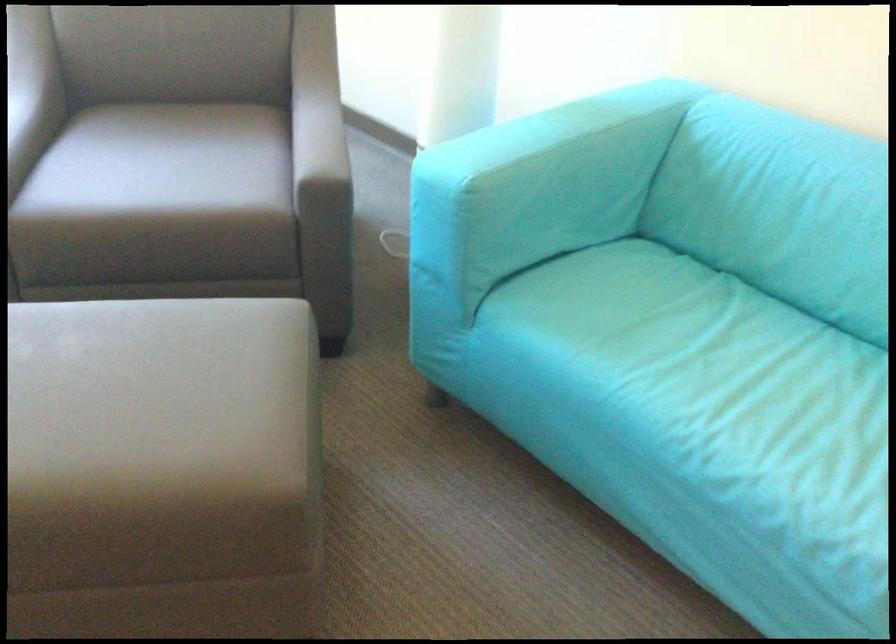
I want to click on gray chair armrest, so click(x=330, y=149).